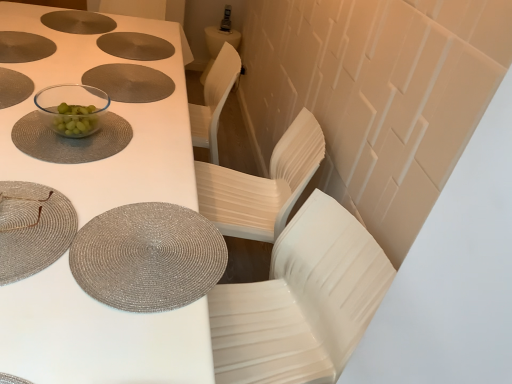
Identify the location of space that is in front of transparent glass bowl at center, placed as the third tableware when sorted from back to front. (71, 180).